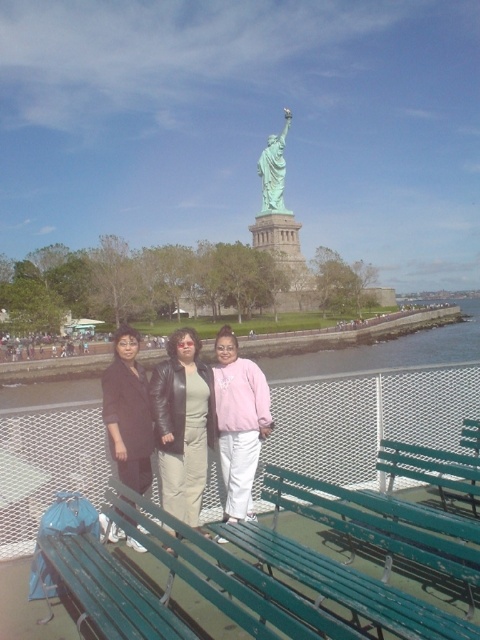
Question: Does green painted metal bench at lower center appear under green patina statue at center?

Choices:
 (A) no
 (B) yes

Answer: (B)

Question: Can you confirm if dark brown leather jacket at center is positioned above green patina statue at center?

Choices:
 (A) no
 (B) yes

Answer: (A)

Question: Estimate the real-world distances between objects in this image. Which object is closer to the green patina statue at center?

Choices:
 (A) green metallic water at lower center
 (B) green painted metal bench at lower center
 (C) dark brown leather jacket at center
 (D) pink fleece jacket at center

Answer: (A)

Question: Which point appears farthest from the camera in this image?

Choices:
 (A) (345, 468)
 (B) (256, 406)
 (C) (422, 566)
 (D) (286, 212)

Answer: (D)

Question: Can you confirm if leather jacket at center is wider than dark brown leather jacket at center?

Choices:
 (A) yes
 (B) no

Answer: (B)

Question: Estimate the real-world distances between objects in this image. Which object is farther from the green painted metal bench at lower center?

Choices:
 (A) green patina statue at center
 (B) green metallic water at lower center
 (C) pink fleece jacket at center
 (D) dark brown leather jacket at center

Answer: (A)